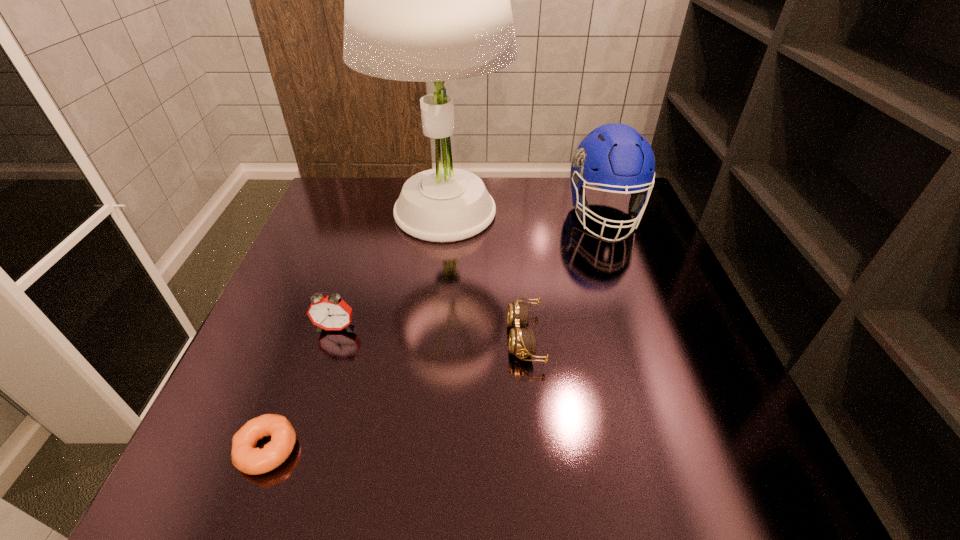
The image size is (960, 540). In order to click on vacant space that's between the shortest object and the lamp in this screenshot , I will do `click(354, 332)`.

Find the location of a particular element. The image size is (960, 540). free space between the tallest object and the shortest object is located at coordinates (354, 332).

At what (x,y) coordinates should I click in order to perform the action: click on blank region between the alarm clock and the goggles. Please return your answer as a coordinate pair (x, y). Looking at the image, I should click on (430, 333).

Identify the location of vacant area that lies between the nearest object and the lamp. Image resolution: width=960 pixels, height=540 pixels. (354, 332).

What are the coordinates of `free spot between the football helmet and the fourth tallest object` in the screenshot? It's located at (564, 277).

At what (x,y) coordinates should I click in order to perform the action: click on unoccupied area between the fourth tallest object and the nearest object. Please return your answer as a coordinate pair (x, y). Looking at the image, I should click on (396, 394).

Find the location of a particular element. This screenshot has height=540, width=960. vacant space in between the lamp and the alarm clock is located at coordinates (389, 271).

Where is `vacant area that lies between the alarm clock and the tallest object`? vacant area that lies between the alarm clock and the tallest object is located at coordinates (389, 271).

The height and width of the screenshot is (540, 960). I want to click on free space between the lamp and the goggles, so click(484, 276).

I want to click on vacant area that lies between the football helmet and the doughnut, so click(x=436, y=333).